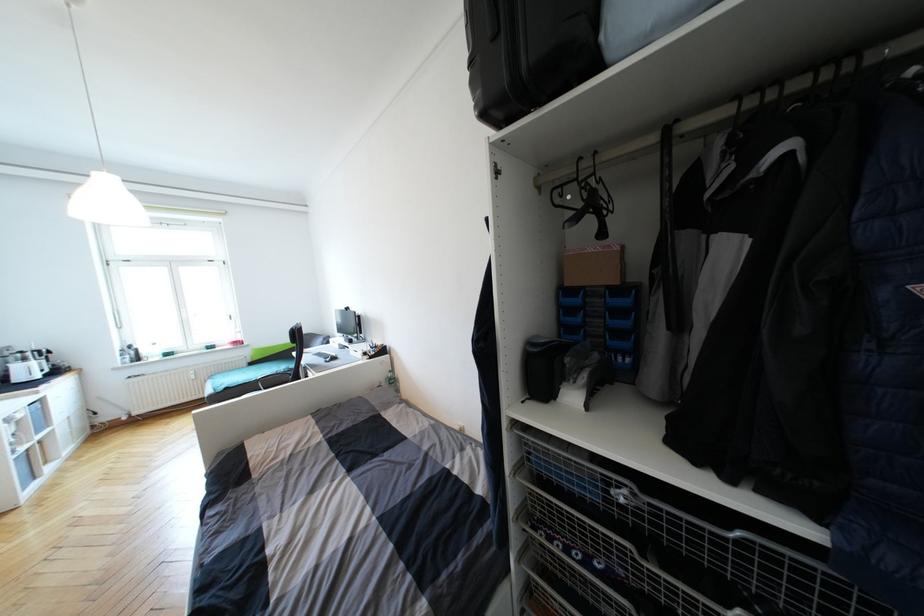
This screenshot has width=924, height=616. In order to click on wire basket drawer in this screenshot , I will do `click(711, 544)`.